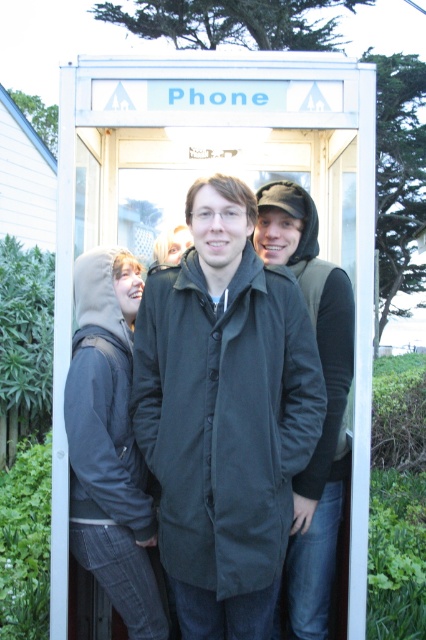
Find the location of a particular element. Image resolution: width=426 pixels, height=640 pixels. dark gray hoodie at center is located at coordinates (109, 444).

The height and width of the screenshot is (640, 426). What do you see at coordinates (109, 444) in the screenshot? I see `dark gray hoodie at center` at bounding box center [109, 444].

Where is `dark gray hoodie at center`? dark gray hoodie at center is located at coordinates (109, 444).

Between metallic phone booth at center and black matte coat at center, which one appears on the left side from the viewer's perspective?

From the viewer's perspective, metallic phone booth at center appears more on the left side.

Is metallic phone booth at center wider than black matte coat at center?

Yes, metallic phone booth at center is wider than black matte coat at center.

Is point (135, 140) farther from camera compared to point (169, 468)?

Yes, it is.

I want to click on metallic phone booth at center, so click(227, 172).

Which is above, metallic phone booth at center or matte black coat at center?

metallic phone booth at center is above.

Is point (299, 84) positioned behind point (293, 621)?

No, it is not.

This screenshot has height=640, width=426. What do you see at coordinates (227, 172) in the screenshot?
I see `metallic phone booth at center` at bounding box center [227, 172].

Where is `metallic phone booth at center`? This screenshot has width=426, height=640. metallic phone booth at center is located at coordinates (227, 172).